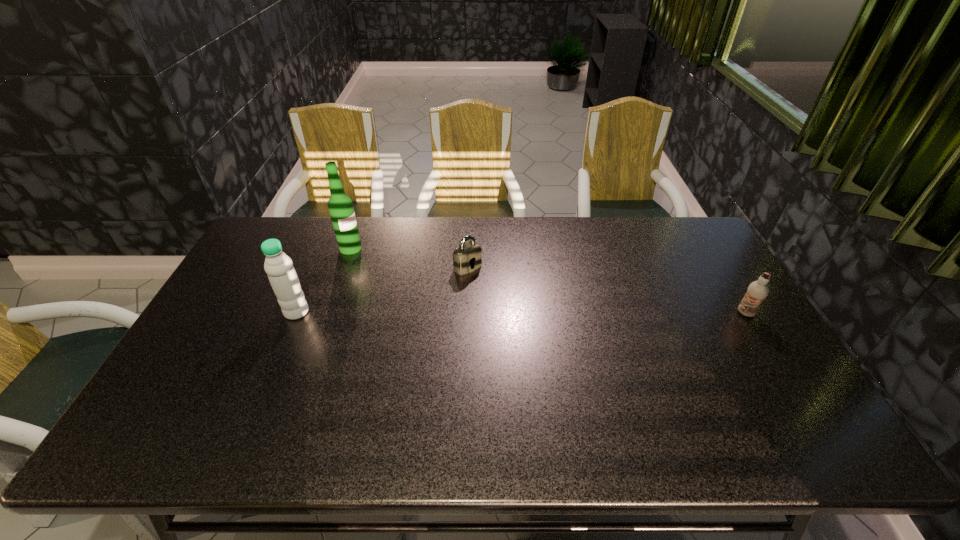
You are a GUI agent. You are given a task and a screenshot of the screen. Output one action in this format:
    pyautogui.click(x=<x>, y=<y>)
    Task: Click on the free space on the desktop that is between the second tallest object and the rightmost object and is positioned on the label of the farthest object
    
    Given the screenshot: What is the action you would take?
    coord(456,312)

Where is `free spot on the desktop that is between the water bottle and the chocolate milk and is positioned at the front of the padlock near the keyhole`? The image size is (960, 540). free spot on the desktop that is between the water bottle and the chocolate milk and is positioned at the front of the padlock near the keyhole is located at coordinates (520, 313).